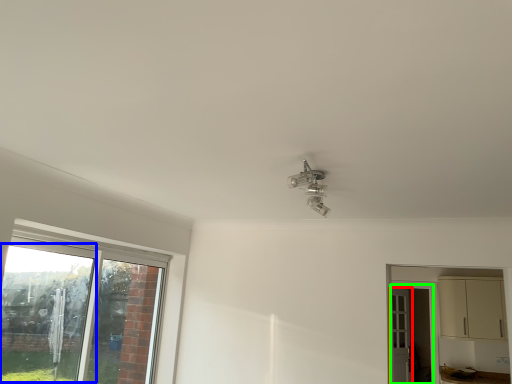
Question: Which object is positioned closest to door (highlighted by a red box)? Select from window screen (highlighted by a blue box) and screen door (highlighted by a green box).

Choices:
 (A) window screen
 (B) screen door

Answer: (B)